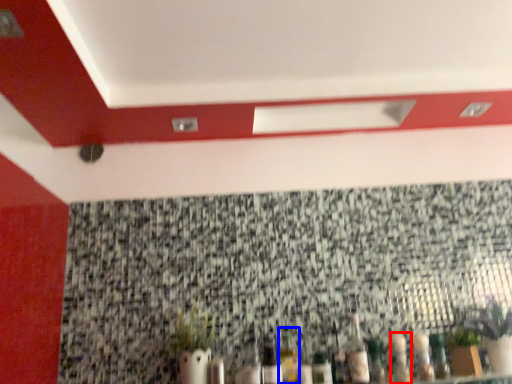
Question: Which object is closer to the camera taking this photo, bottle (highlighted by a red box) or bottle (highlighted by a blue box)?

Choices:
 (A) bottle
 (B) bottle

Answer: (A)